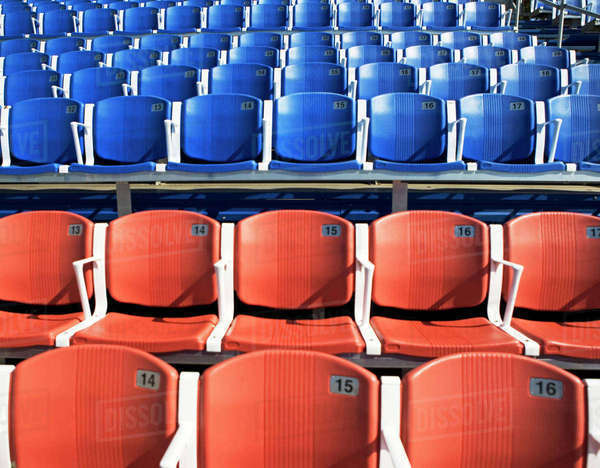
Locate an element on the screen. Image resolution: width=600 pixels, height=468 pixels. blue seat bottoms is located at coordinates (42, 168), (116, 169), (202, 167), (315, 169), (422, 167), (521, 167), (590, 167), (273, 296).